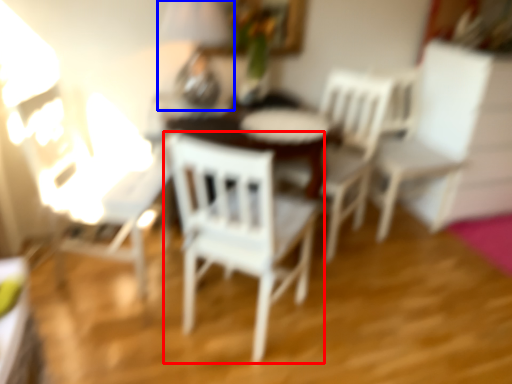
Question: Which object appears farthest to the camera in this image, chair (highlighted by a red box) or table lamp (highlighted by a blue box)?

Choices:
 (A) chair
 (B) table lamp

Answer: (B)